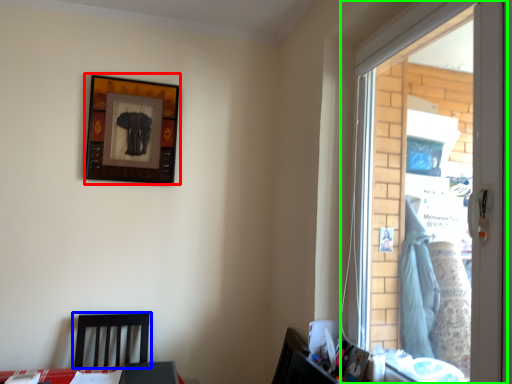
Question: Based on their relative distances, which object is farther from picture frame (highlighted by a red box)? Choose from furniture (highlighted by a blue box) and window (highlighted by a green box).

Choices:
 (A) furniture
 (B) window

Answer: (B)